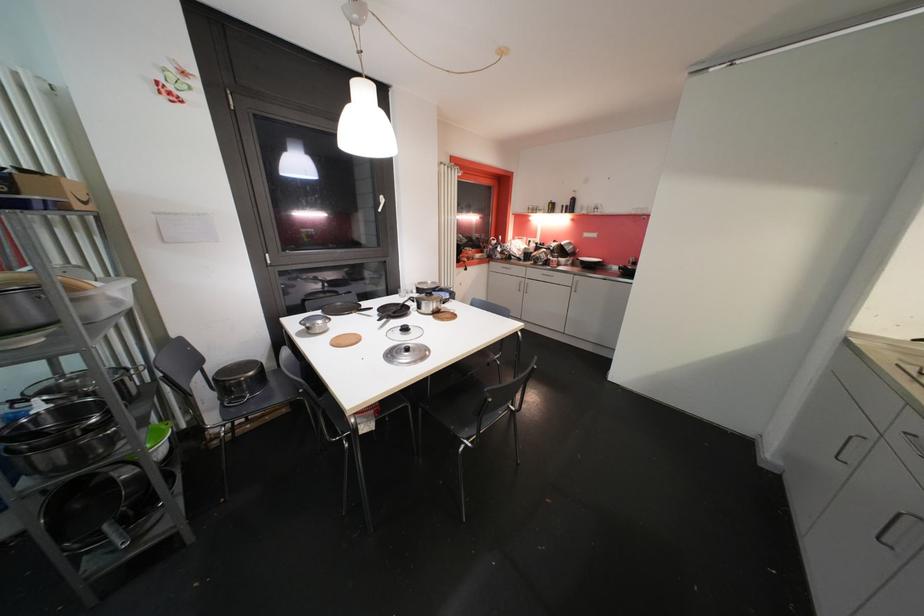
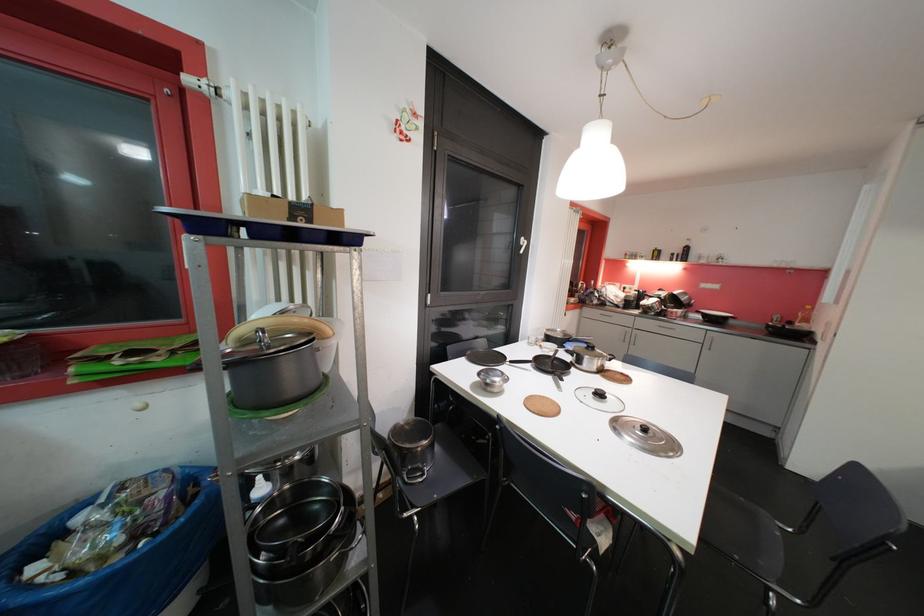
Find the pixel in the second image that matches the point at 411,352 in the first image.

(650, 432)